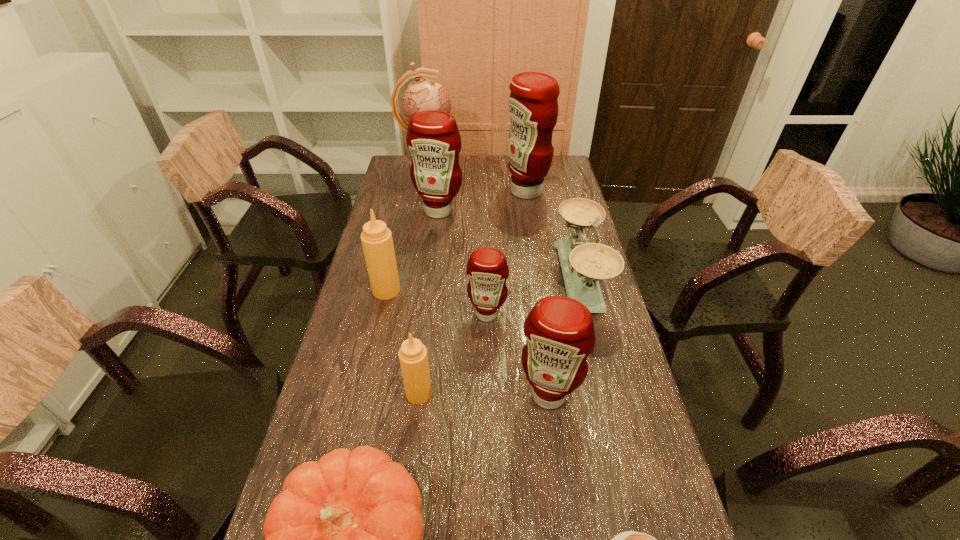
I want to click on free space at the left edge, so click(x=362, y=295).

The height and width of the screenshot is (540, 960). In the image, there is a desktop. In order to click on vacant space at the right edge in this screenshot , I will do `click(545, 209)`.

You are a GUI agent. You are given a task and a screenshot of the screen. Output one action in this format:
    pyautogui.click(x=<x>, y=<y>)
    Task: Click on the vacant space at the far left corner of the desktop
    This screenshot has width=960, height=540.
    Given the screenshot: What is the action you would take?
    pyautogui.click(x=396, y=162)

Find the location of `free space at the far right corner`. free space at the far right corner is located at coordinates (565, 180).

Where is `free spot between the second red condiment from left to right and the nearest red condiment`? The width and height of the screenshot is (960, 540). free spot between the second red condiment from left to right and the nearest red condiment is located at coordinates (517, 354).

You are a GUI agent. You are given a task and a screenshot of the screen. Output one action in this format:
    pyautogui.click(x=<x>, y=<y>)
    Task: Click on the vacant region between the nearest red condiment and the fourth nearest condiment
    This screenshot has height=540, width=960.
    Given the screenshot: What is the action you would take?
    pyautogui.click(x=468, y=342)

The width and height of the screenshot is (960, 540). What are the coordinates of `vacant point located between the scale and the third nearest condiment` in the screenshot? It's located at (534, 296).

Image resolution: width=960 pixels, height=540 pixels. What are the coordinates of `free spot between the eighth shortest object and the bigger tan condiment` in the screenshot? It's located at (413, 251).

Point out which object is positioned as the ninth nearest to the scale. Please provide its 2D coordinates. Your answer should be formatted as a tuple, i.e. [(x, y)], where the tuple contains the x and y coordinates of a point satisfying the conditions above.

[(424, 94)]

I want to click on the third closest object to the scale, so click(533, 106).